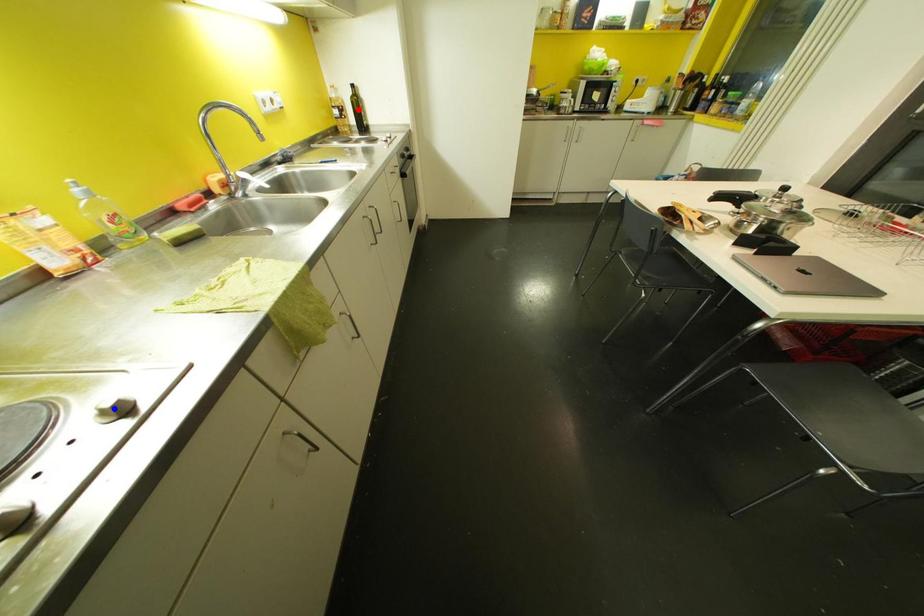
Question: Which of the two points in the image is closer to the camera?

Choices:
 (A) Blue point is closer.
 (B) Red point is closer.

Answer: (A)